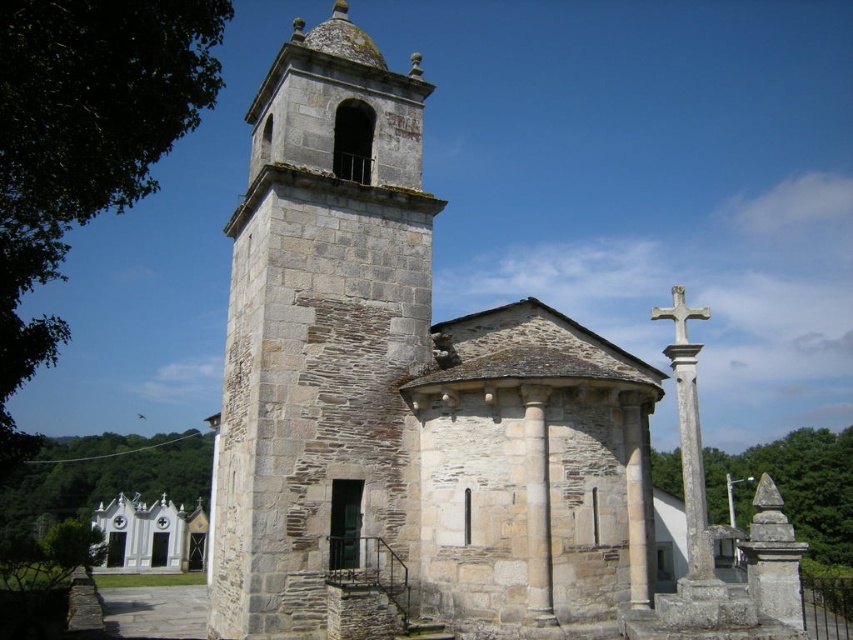
Question: Which of the following is the farthest from the observer?

Choices:
 (A) white stone cross at upper right
 (B) white painted wood at lower left

Answer: (B)

Question: Is gray stone tower at center positioned behind white stone cross at upper right?

Choices:
 (A) yes
 (B) no

Answer: (A)

Question: Does gray stone tower at center have a lesser width compared to white painted wood at lower left?

Choices:
 (A) yes
 (B) no

Answer: (A)

Question: Which of the following is the farthest from the observer?

Choices:
 (A) (175, 515)
 (B) (659, 310)
 (C) (221, 576)

Answer: (A)

Question: Does gray stone tower at center appear on the right side of white stone cross at upper right?

Choices:
 (A) yes
 (B) no

Answer: (B)

Question: Which object appears farthest from the camera in this image?

Choices:
 (A) white painted wood at lower left
 (B) white stone cross at upper right
 (C) gray stone tower at center

Answer: (A)